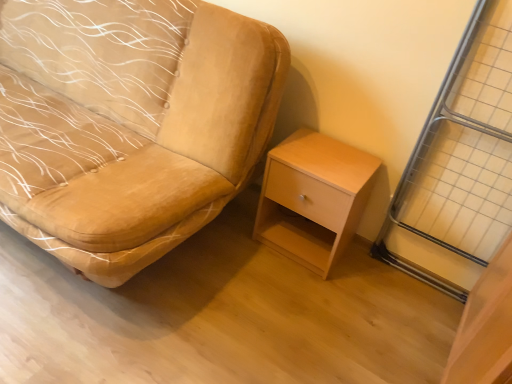
Question: Does metallic silver screen door at right turn towards light wood/finely finished nightstand at lower right?

Choices:
 (A) yes
 (B) no

Answer: (B)

Question: Is metallic silver screen door at right positioned with its back to light wood/finely finished nightstand at lower right?

Choices:
 (A) no
 (B) yes

Answer: (A)

Question: Is metallic silver screen door at right shorter than light wood/finely finished nightstand at lower right?

Choices:
 (A) yes
 (B) no

Answer: (B)

Question: Does metallic silver screen door at right appear on the right side of light wood/finely finished nightstand at lower right?

Choices:
 (A) no
 (B) yes

Answer: (B)

Question: Does metallic silver screen door at right appear on the left side of light wood/finely finished nightstand at lower right?

Choices:
 (A) no
 (B) yes

Answer: (A)

Question: From a real-world perspective, relative to metallic silver screen door at right, is velvet beige chair at center vertically above or below?

Choices:
 (A) below
 (B) above

Answer: (A)

Question: Considering the positions of velvet beige chair at center and metallic silver screen door at right in the image, is velvet beige chair at center wider or thinner than metallic silver screen door at right?

Choices:
 (A) thin
 (B) wide

Answer: (B)

Question: Relative to metallic silver screen door at right, is velvet beige chair at center in front or behind?

Choices:
 (A) front
 (B) behind

Answer: (A)

Question: Do you think velvet beige chair at center is within metallic silver screen door at right, or outside of it?

Choices:
 (A) outside
 (B) inside

Answer: (A)

Question: Would you say light wood/finely finished nightstand at lower right is to the left or to the right of velvet beige chair at center in the picture?

Choices:
 (A) left
 (B) right

Answer: (B)

Question: Considering the positions of light wood/finely finished nightstand at lower right and velvet beige chair at center in the image, is light wood/finely finished nightstand at lower right wider or thinner than velvet beige chair at center?

Choices:
 (A) thin
 (B) wide

Answer: (A)

Question: From the image's perspective, relative to velvet beige chair at center, is light wood/finely finished nightstand at lower right above or below?

Choices:
 (A) above
 (B) below

Answer: (B)

Question: From a real-world perspective, relative to velvet beige chair at center, is light wood/finely finished nightstand at lower right vertically above or below?

Choices:
 (A) above
 (B) below

Answer: (B)

Question: In terms of width, does light wood/finely finished nightstand at lower right look wider or thinner when compared to metallic silver screen door at right?

Choices:
 (A) wide
 (B) thin

Answer: (A)

Question: Is point (297, 246) closer or farther from the camera than point (487, 69)?

Choices:
 (A) closer
 (B) farther

Answer: (B)